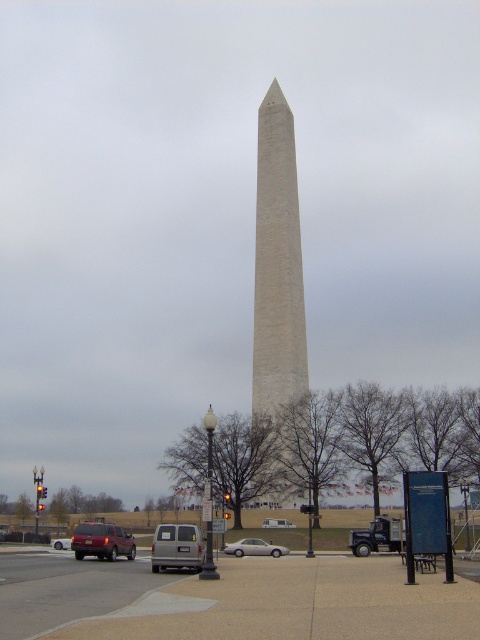
Is silver metallic van at center above white matte van at center?

Indeed, silver metallic van at center is positioned over white matte van at center.

Is point (156, 529) closer to viewer compared to point (294, 528)?

Yes.

Locate an element on the screen. silver metallic van at center is located at coordinates (177, 547).

Looking at this image, which is below, white stone obelisk at center or white matte van at center?

white matte van at center is below.

Measure the distance between point [289,140] and camera.

Point [289,140] and camera are 83.36 meters apart from each other.

Is point (268, 166) farther from viewer compared to point (277, 518)?

Yes, it is.

Where is `white stone obelisk at center`? Image resolution: width=480 pixels, height=640 pixels. white stone obelisk at center is located at coordinates (277, 262).

Is silver metallic car at lower center taller than matte red suv at lower left?

Incorrect, silver metallic car at lower center's height is not larger of matte red suv at lower left's.

Is point (259, 552) in front of point (68, 541)?

That is True.

Between point (286, 552) and point (52, 540), which one is positioned in front?

Positioned in front is point (286, 552).

You are a GUI agent. You are given a task and a screenshot of the screen. Output one action in this format:
    pyautogui.click(x=<x>, y=<y>)
    Task: Click on the silver metallic car at lower center
    The width and height of the screenshot is (480, 640).
    Given the screenshot: What is the action you would take?
    pyautogui.click(x=254, y=547)